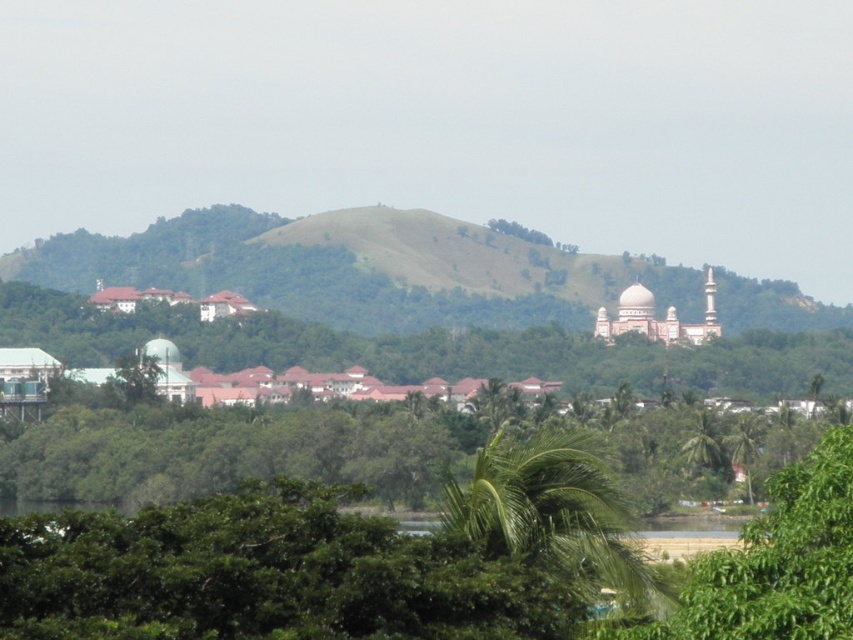
Can you confirm if green grassy hillside at center is shorter than green leafy palm at center?

In fact, green grassy hillside at center may be taller than green leafy palm at center.

Based on the photo, can you confirm if green grassy hillside at center is thinner than green leafy palm at center?

In fact, green grassy hillside at center might be wider than green leafy palm at center.

Locate an element on the screen. Image resolution: width=853 pixels, height=640 pixels. green grassy hillside at center is located at coordinates (357, 268).

Is green grassy hillside at center smaller than green leafy tree at center?

Actually, green grassy hillside at center might be larger than green leafy tree at center.

Who is lower down, green grassy hillside at center or green leafy tree at center?

green leafy tree at center is below.

Is point (480, 301) farther from camera compared to point (231, 326)?

Yes, it is behind point (231, 326).

Locate an element on the screen. Image resolution: width=853 pixels, height=640 pixels. green grassy hillside at center is located at coordinates (357, 268).

Does green leafy tree at center appear on the left side of green leafy palm at center?

Correct, you'll find green leafy tree at center to the left of green leafy palm at center.

Between green leafy tree at center and green leafy palm at center, which one has less height?

green leafy palm at center is shorter.

Where is `green leafy tree at center`? green leafy tree at center is located at coordinates coord(428,348).